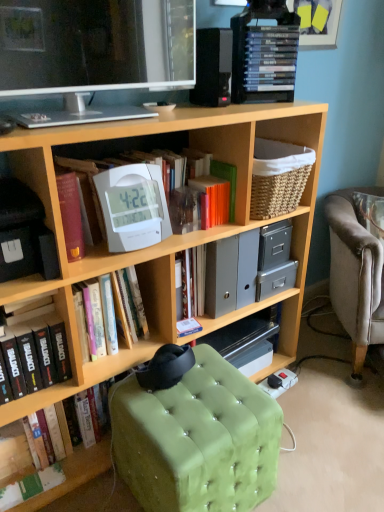
Image resolution: width=384 pixels, height=512 pixels. In order to click on vacant region to the right of green tufted ottoman at lower center in this screenshot , I will do `click(318, 464)`.